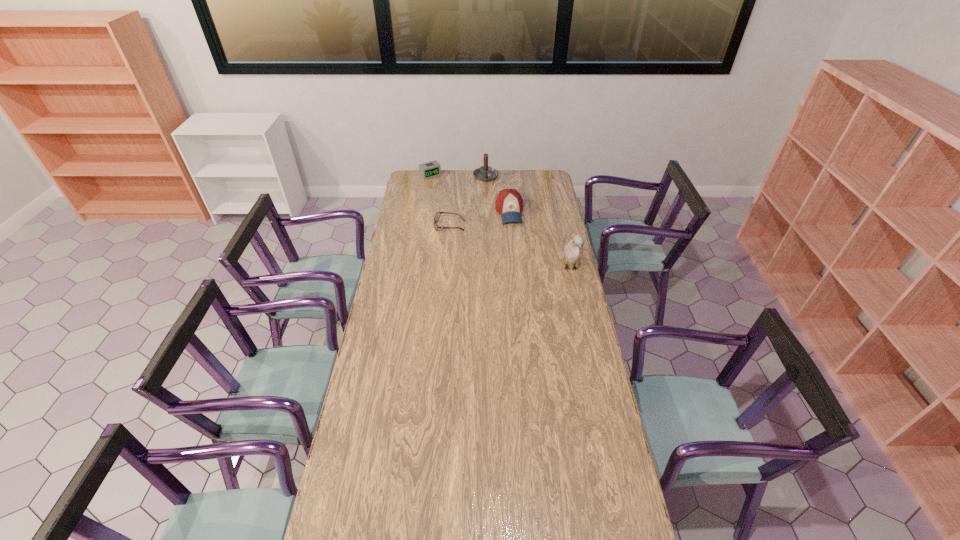
You are a GUI agent. You are given a task and a screenshot of the screen. Output one action in this format:
    pyautogui.click(x=<x>, y=<y>)
    Task: Click on the alarm clock that is at the far edge
    This screenshot has height=540, width=960.
    Given the screenshot: What is the action you would take?
    pyautogui.click(x=431, y=169)

The height and width of the screenshot is (540, 960). Find the location of `object that is at the left edge`. object that is at the left edge is located at coordinates (431, 169).

Identify the location of object present at the right edge. The image size is (960, 540). (573, 252).

Locate an element on the screen. This screenshot has width=960, height=540. object present at the far left corner is located at coordinates (431, 169).

Where is `vacant region at the far edge`? Image resolution: width=960 pixels, height=540 pixels. vacant region at the far edge is located at coordinates (502, 174).

At what (x,y) coordinates should I click in order to perform the action: click on vacant space at the near edge. Please return your answer as a coordinate pair (x, y). The image size is (960, 540). Looking at the image, I should click on (453, 510).

The image size is (960, 540). In order to click on free space at the left edge of the desktop in this screenshot , I will do `click(355, 464)`.

Locate an element on the screen. The image size is (960, 540). free space at the right edge of the desktop is located at coordinates (545, 230).

Locate an element on the screen. The image size is (960, 540). vacant area at the near right corner of the desktop is located at coordinates (591, 521).

I want to click on vacant space that is in between the sunglasses and the third tallest object, so click(x=480, y=219).